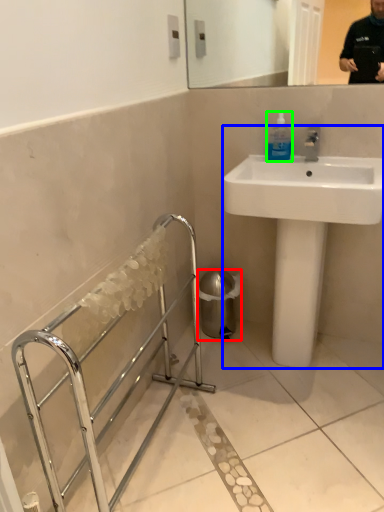
Question: Which is farther away from trash bin/can (highlighted by a red box)? sink (highlighted by a blue box) or mouthwash (highlighted by a green box)?

Choices:
 (A) sink
 (B) mouthwash

Answer: (B)